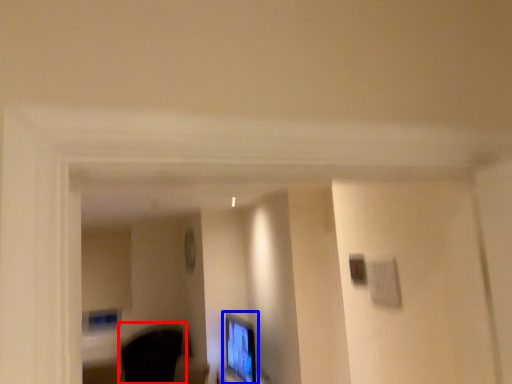
Question: Among these objects, which one is farthest to the camera, swivel chair (highlighted by a red box) or computer monitor (highlighted by a blue box)?

Choices:
 (A) swivel chair
 (B) computer monitor

Answer: (A)